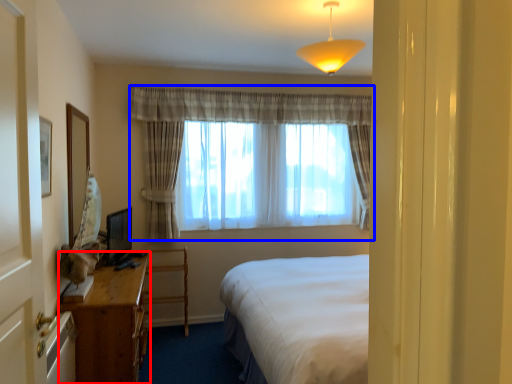
Question: Which object is closer to the camera taking this photo, desk (highlighted by a red box) or curtain (highlighted by a blue box)?

Choices:
 (A) desk
 (B) curtain

Answer: (A)